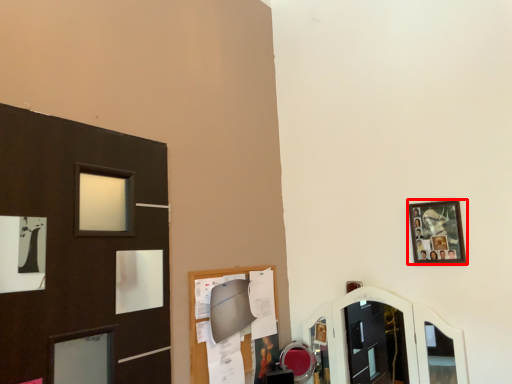
Question: From the image's perspective, where is picture frame (annotated by the red box) located in relation to mirror in the image?

Choices:
 (A) below
 (B) above

Answer: (B)